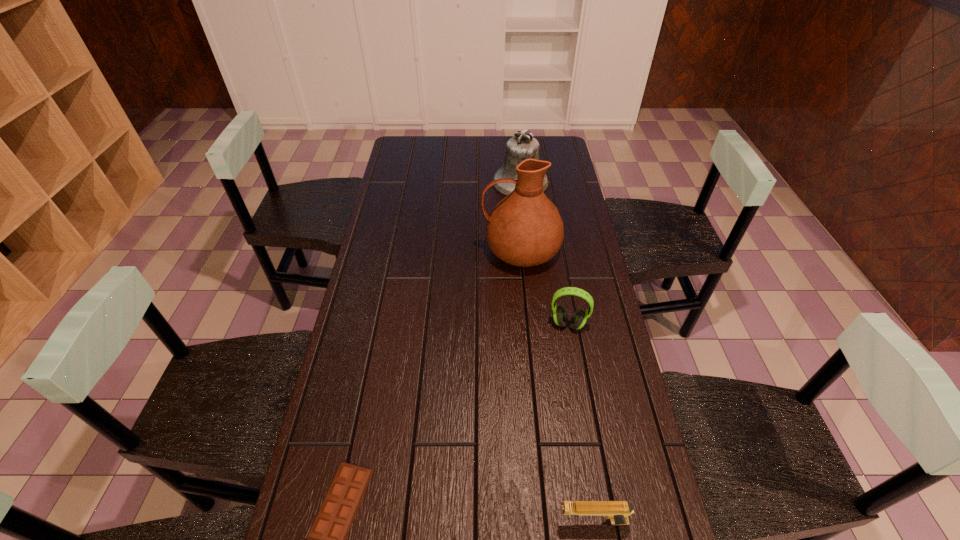
This screenshot has width=960, height=540. What are the coordinates of `the tallest object` in the screenshot? It's located at (525, 229).

In order to click on the second farthest object in this screenshot , I will do `click(525, 229)`.

Where is `bell`? The image size is (960, 540). bell is located at coordinates (523, 145).

Where is `the farthest object`? the farthest object is located at coordinates (523, 145).

Identify the location of the third nearest object. (578, 319).

Find the location of a particular element. The image size is (960, 540). the third tallest object is located at coordinates (578, 319).

Identify the location of the fourth tallest object. coord(617,511).

In order to click on vacant space located on the side of the pitcher with the handle in this screenshot , I will do `click(423, 251)`.

Identify the location of blank space located 0.340m on the side of the pitcher with the handle. (384, 251).

The image size is (960, 540). Identify the location of free space located 0.050m on the side of the pitcher with the handle. (467, 251).